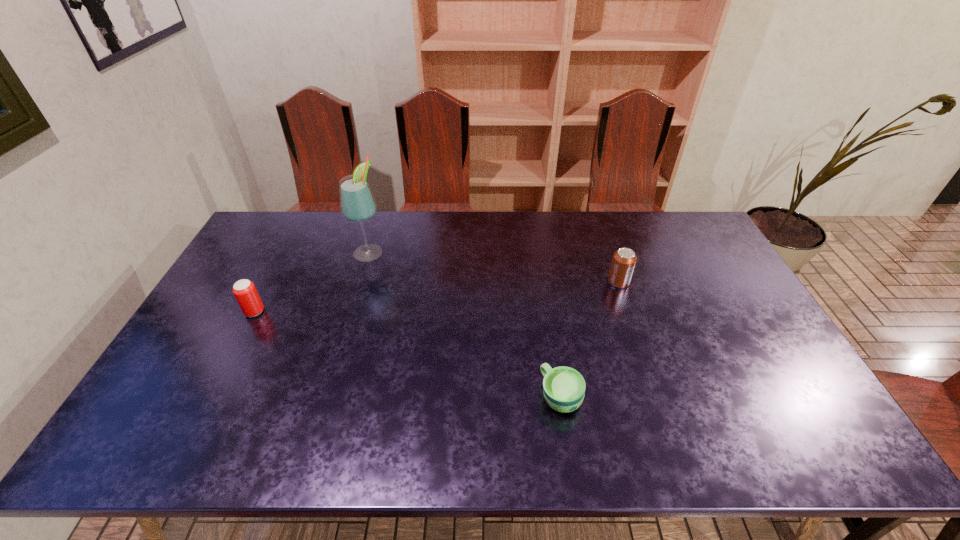
Identify the location of free space located on the right of the third farthest object. (291, 312).

Locate an element on the screen. The width and height of the screenshot is (960, 540). vacant space located 0.080m on the front of the shortest object is located at coordinates (569, 451).

Locate an element on the screen. The height and width of the screenshot is (540, 960). object present at the far edge is located at coordinates (357, 204).

Locate an element on the screen. Image resolution: width=960 pixels, height=540 pixels. object situated at the left edge is located at coordinates (244, 290).

Identify the location of free location at the far edge. This screenshot has height=540, width=960. (574, 245).

Locate an element on the screen. This screenshot has height=540, width=960. blank space at the near edge of the desktop is located at coordinates (420, 426).

You are a GUI agent. You are given a task and a screenshot of the screen. Output one action in this format:
    pyautogui.click(x=<x>, y=<y>)
    Task: Click on the vacant space at the left edge
    This screenshot has height=540, width=960.
    Given the screenshot: What is the action you would take?
    pyautogui.click(x=223, y=310)

In order to click on vacant space at the right edge of the desktop in this screenshot , I will do `click(766, 330)`.

In the image, there is a desktop. Where is `free region at the far right corner`? free region at the far right corner is located at coordinates (653, 212).

This screenshot has height=540, width=960. What are the coordinates of `free space that is in between the cup and the rightmost object` in the screenshot? It's located at (589, 339).